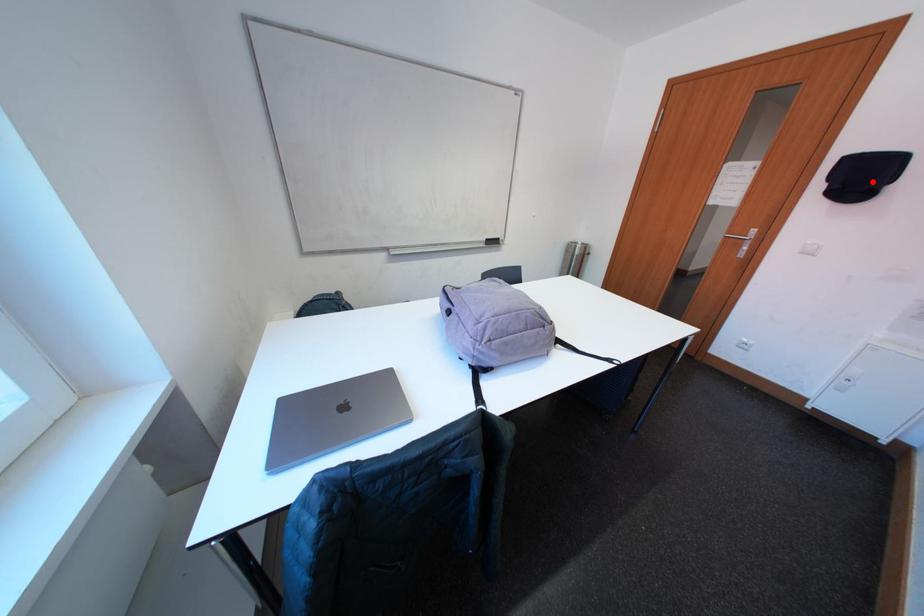
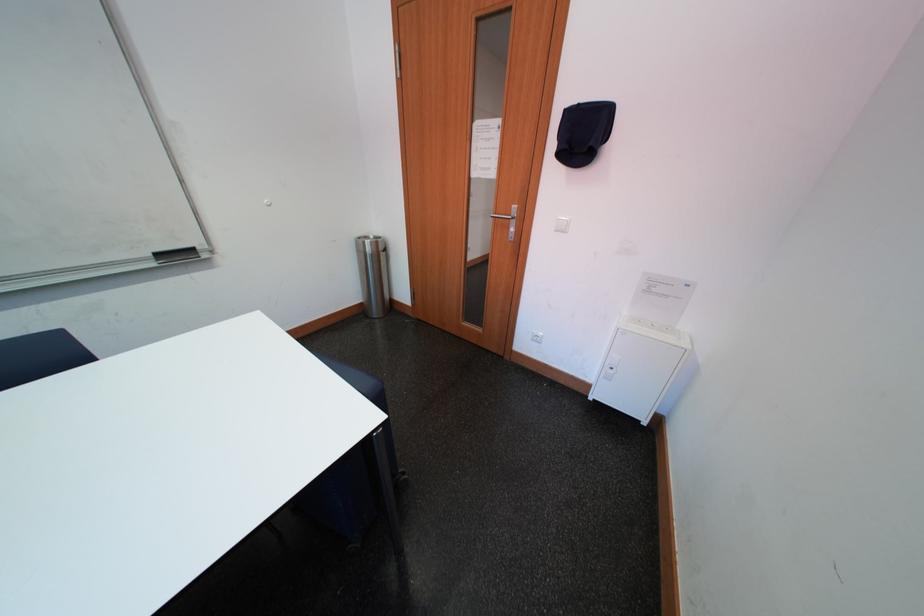
Where in the second image is the point corresponding to the highlighted location from the first image?

(593, 140)